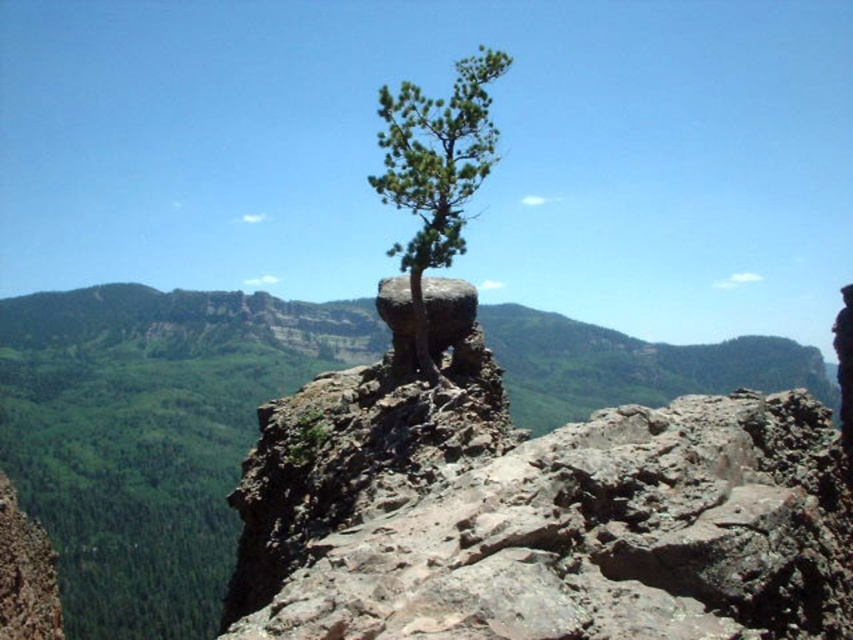
Question: Does green rough textured tree at center have a greater width compared to rusty rock at center?

Choices:
 (A) yes
 (B) no

Answer: (A)

Question: Is green rough textured tree at center to the right of rusty rock at center from the viewer's perspective?

Choices:
 (A) no
 (B) yes

Answer: (A)

Question: Is green rough textured tree at center to the left of rusty rock at center from the viewer's perspective?

Choices:
 (A) no
 (B) yes

Answer: (B)

Question: Among these points, which one is farthest from the camera?

Choices:
 (A) (473, 291)
 (B) (461, 65)

Answer: (A)